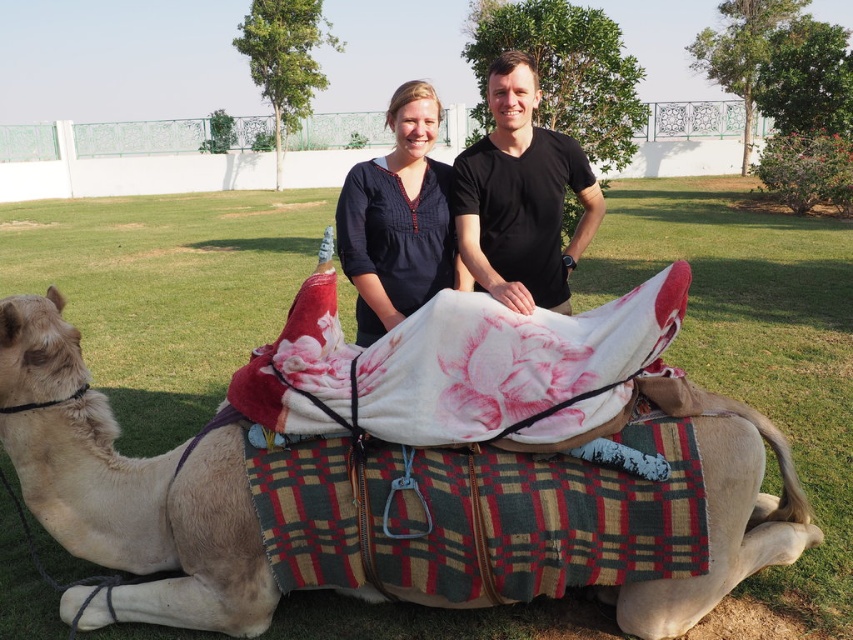
Based on the scene description, what are the coordinates of the beige woolen camel at center?

The beige woolen camel at center is located at coordinates point (148, 515).

You are trying to take a photo of the beige woolen camel at center and the dark blue cotton shirt at center. If you want to position yourself so that the camel is between you and the shirt, where should you stand relative to the shirt?

You should stand to the right of the dark blue cotton shirt at center because the beige woolen camel at center is already to the left of the shirt, so placing yourself to the right of the shirt will place the camel between you and the shirt.

Based on the photo, you are a photographer trying to adjust the lighting for a group photo. You notice two people in the scene wearing the black matte shirt at center and the dark blue cotton shirt at center. Which shirt should you focus your lighting on to ensure it stands out more, considering their sizes?

The black matte shirt at center is bigger than the dark blue cotton shirt at center, so focusing the lighting on the black matte shirt at center would make it stand out more due to its larger size.